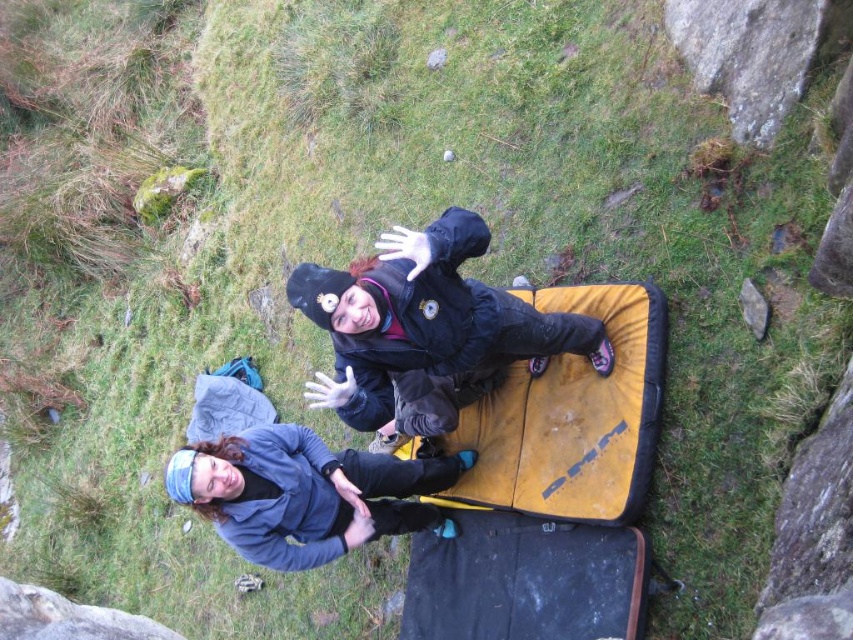
Question: Which object is the farthest from the smooth gray rock at center right?

Choices:
 (A) blue fleece jacket at lower center
 (B) smooth gray rock at lower left
 (C) black matte jacket at center
 (D) yellow fabric mat at center

Answer: (B)

Question: Which object appears closest to the camera in this image?

Choices:
 (A) blue fleece jacket at lower center
 (B) smooth gray rock at lower left
 (C) yellow fabric mat at center
 (D) smooth gray rock at center right

Answer: (A)

Question: Considering the relative positions of yellow fabric mat at center and blue fleece jacket at lower center in the image provided, where is yellow fabric mat at center located with respect to blue fleece jacket at lower center?

Choices:
 (A) below
 (B) above

Answer: (B)

Question: Which of the following is the farthest from the observer?

Choices:
 (A) [474, 417]
 (B) [300, 556]
 (C) [51, 621]
 (D) [746, 300]

Answer: (A)

Question: Is yellow fabric mat at center behind smooth gray rock at lower left?

Choices:
 (A) yes
 (B) no

Answer: (A)

Question: In this image, where is black matte jacket at center located relative to blue fleece jacket at lower center?

Choices:
 (A) below
 (B) above

Answer: (B)